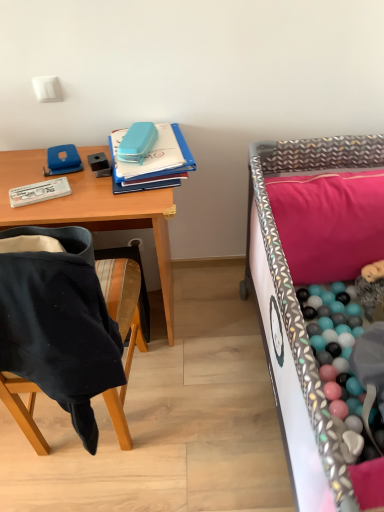
The image size is (384, 512). Describe the element at coordinates (301, 323) in the screenshot. I see `patterned fabric infant bed at right` at that location.

Identify the location of patterned fabric infant bed at right. (301, 323).

Considering the relative sizes of patterned fabric infant bed at right and pink fabric pillow at upper right in the image provided, is patterned fabric infant bed at right shorter than pink fabric pillow at upper right?

Incorrect, the height of patterned fabric infant bed at right does not fall short of that of pink fabric pillow at upper right.

Between patterned fabric infant bed at right and pink fabric pillow at upper right, which one appears on the right side from the viewer's perspective?

Positioned to the right is patterned fabric infant bed at right.

Can you see patterned fabric infant bed at right touching pink fabric pillow at upper right?

They are not placed beside each other.

You are a GUI agent. You are given a task and a screenshot of the screen. Output one action in this format:
    pyautogui.click(x=<x>, y=<y>)
    Task: Click on the infant bed in front of the pink fabric pillow at upper right
    The image size is (384, 512).
    Given the screenshot: What is the action you would take?
    pyautogui.click(x=301, y=323)

What's the angular difference between pink fabric pillow at upper right and blue plastic notebook at upper center's facing directions?

The angle between the facing direction of pink fabric pillow at upper right and the facing direction of blue plastic notebook at upper center is 99 degrees.

Considering their positions, is pink fabric pillow at upper right located in front of or behind blue plastic notebook at upper center?

In the image, pink fabric pillow at upper right appears behind blue plastic notebook at upper center.

Considering the sizes of objects pink fabric pillow at upper right and blue plastic notebook at upper center in the image provided, who is taller, pink fabric pillow at upper right or blue plastic notebook at upper center?

pink fabric pillow at upper right is taller.

Between pink fabric pillow at upper right and blue plastic notebook at upper center, which one has larger size?

Bigger between the two is pink fabric pillow at upper right.

How much distance is there between black fabric chair at left and patterned fabric infant bed at right?

A distance of 54.76 centimeters exists between black fabric chair at left and patterned fabric infant bed at right.

Is black fabric chair at left taller or shorter than patterned fabric infant bed at right?

In the image, black fabric chair at left appears to be shorter than patterned fabric infant bed at right.

Does point (116, 267) come behind point (249, 192)?

No, it is in front of (249, 192).

Is black fabric chair at left aimed at patterned fabric infant bed at right?

No, black fabric chair at left does not turn towards patterned fabric infant bed at right.

Does wooden desk at upper left have a smaller size compared to blue plastic notebook at upper center?

Incorrect, wooden desk at upper left is not smaller in size than blue plastic notebook at upper center.

Is wooden desk at upper left taller or shorter than blue plastic notebook at upper center?

wooden desk at upper left is taller than blue plastic notebook at upper center.

Is wooden desk at upper left not inside blue plastic notebook at upper center?

Indeed, wooden desk at upper left is completely outside blue plastic notebook at upper center.

Is blue plastic notebook at upper center spatially inside pink fabric pillow at upper right, or outside of it?

The correct answer is: outside.

Is point (150, 177) positioned after point (354, 266)?

No, (150, 177) is closer to viewer.

Considering the sizes of objects blue plastic notebook at upper center and pink fabric pillow at upper right in the image provided, who is thinner, blue plastic notebook at upper center or pink fabric pillow at upper right?

blue plastic notebook at upper center is thinner.

Based on their positions, is blue plastic notebook at upper center located to the left or right of pink fabric pillow at upper right?

Clearly, blue plastic notebook at upper center is on the left of pink fabric pillow at upper right in the image.

Is pink fabric pillow at upper right not close to wooden desk at upper left?

→ No, pink fabric pillow at upper right is not far from wooden desk at upper left.

This screenshot has width=384, height=512. I want to click on desk below the pink fabric pillow at upper right (from the image's perspective), so click(x=91, y=209).

Is wooden desk at upper left at the back of pink fabric pillow at upper right?

pink fabric pillow at upper right does not have its back to wooden desk at upper left.

How far apart are wooden desk at upper left and black fabric chair at left?

A distance of 10.64 inches exists between wooden desk at upper left and black fabric chair at left.

Would you say wooden desk at upper left is outside black fabric chair at left?

Yes, wooden desk at upper left is outside of black fabric chair at left.

Where is `chair that is on the right side of wooden desk at upper left`? The height and width of the screenshot is (512, 384). chair that is on the right side of wooden desk at upper left is located at coordinates (123, 298).

Is wooden desk at upper left looking in the opposite direction of black fabric chair at left?

wooden desk at upper left does not have its back to black fabric chair at left.

Where is `infant bed below the pink fabric pillow at upper right (from a real-world perspective)`? The image size is (384, 512). infant bed below the pink fabric pillow at upper right (from a real-world perspective) is located at coordinates (301, 323).

Where is `notebook on the left of pink fabric pillow at upper right`? notebook on the left of pink fabric pillow at upper right is located at coordinates (156, 161).

In the scene shown: Estimate the real-world distances between objects in this image. Which object is further from pink fabric pillow at upper right, patterned fabric infant bed at right or black fabric chair at left?

black fabric chair at left.

Looking at the image, which one is located closer to pink fabric pillow at upper right, blue plastic notebook at upper center or patterned fabric infant bed at right?

The object closer to pink fabric pillow at upper right is patterned fabric infant bed at right.

Estimate the real-world distances between objects in this image. Which object is further from black fabric chair at left, pink fabric pillow at upper right or wooden desk at upper left?

Based on the image, pink fabric pillow at upper right appears to be further to black fabric chair at left.

When comparing their distances from blue plastic notebook at upper center, does patterned fabric infant bed at right or wooden desk at upper left seem further?

patterned fabric infant bed at right is further to blue plastic notebook at upper center.

Based on their spatial positions, is black fabric chair at left or wooden desk at upper left further from pink fabric pillow at upper right?

Based on the image, black fabric chair at left appears to be further to pink fabric pillow at upper right.

Considering their positions, is blue plastic notebook at upper center positioned closer to pink fabric pillow at upper right than wooden desk at upper left?

Among the two, blue plastic notebook at upper center is located nearer to pink fabric pillow at upper right.

From the picture: Which object lies nearer to the anchor point wooden desk at upper left, pink fabric pillow at upper right or black fabric chair at left?

black fabric chair at left is positioned closer to the anchor wooden desk at upper left.

Estimate the real-world distances between objects in this image. Which object is closer to black fabric chair at left, patterned fabric infant bed at right or blue plastic notebook at upper center?

Based on the image, blue plastic notebook at upper center appears to be nearer to black fabric chair at left.

The width and height of the screenshot is (384, 512). In order to click on pillow situated between black fabric chair at left and patterned fabric infant bed at right from left to right in this screenshot , I will do `click(329, 223)`.

At what (x,y) coordinates should I click in order to perform the action: click on notebook between black fabric chair at left and patterned fabric infant bed at right. Please return your answer as a coordinate pair (x, y). Looking at the image, I should click on (156, 161).

This screenshot has width=384, height=512. What are the coordinates of `notebook located between patterned fabric infant bed at right and pink fabric pillow at upper right in the depth direction` in the screenshot? It's located at (156, 161).

The height and width of the screenshot is (512, 384). I want to click on notebook between wooden desk at upper left and patterned fabric infant bed at right from left to right, so click(156, 161).